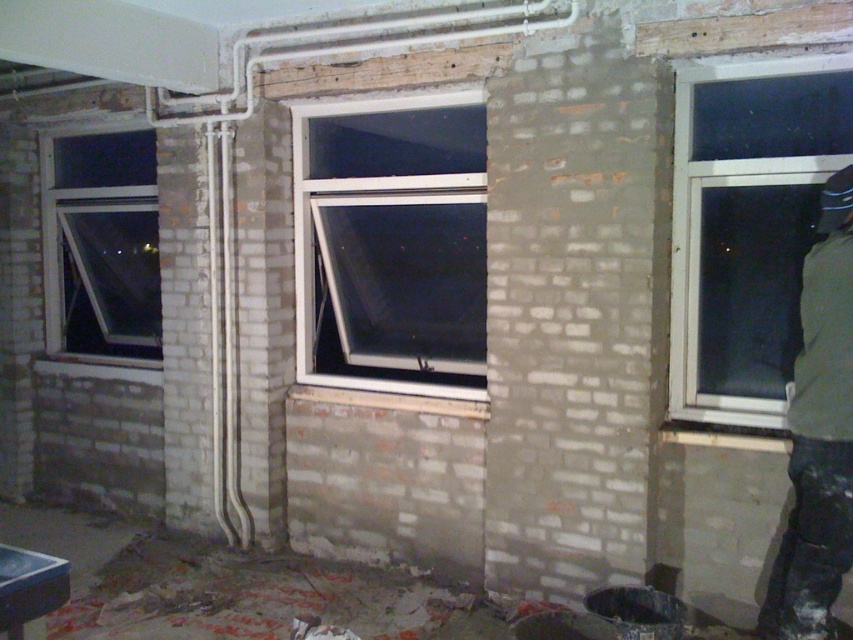
You are an interior designer assessing the room layout. You notice the white plastic window at center and the clear glass window at left. Which window is located to the right of the other?

The white plastic window at center is positioned on the right side of clear glass window at left.

You are standing in the room and want to reach a specific point marked at coordinates point (473, 387). If your current position is 10 feet away from the camera, can you walk directly to that point without moving closer than 12 feet to the camera?

The distance of point (473, 387) from camera is 13.12 feet, so yes, you can walk directly to that point since it is farther than 12 feet from the camera.